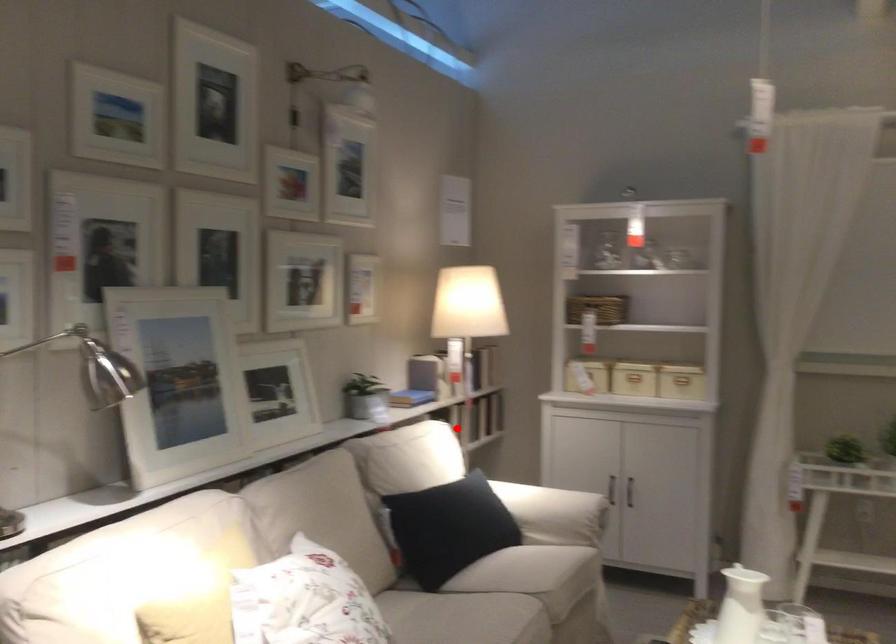
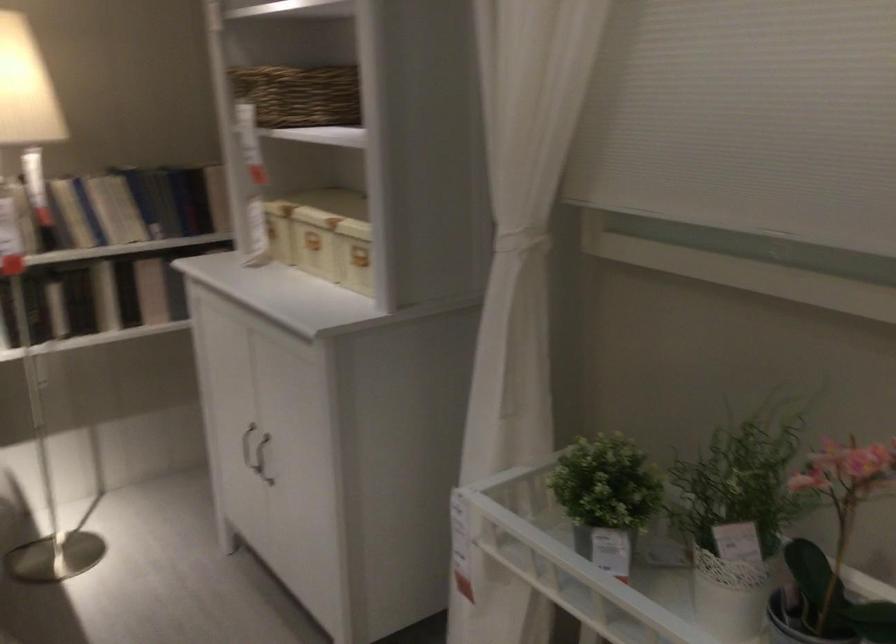
Question: I am providing you with two images of the same scene from different viewpoints. A red point is marked on the first image. Is the red point's position out of view in image 2?

Choices:
 (A) Yes
 (B) No

Answer: (B)